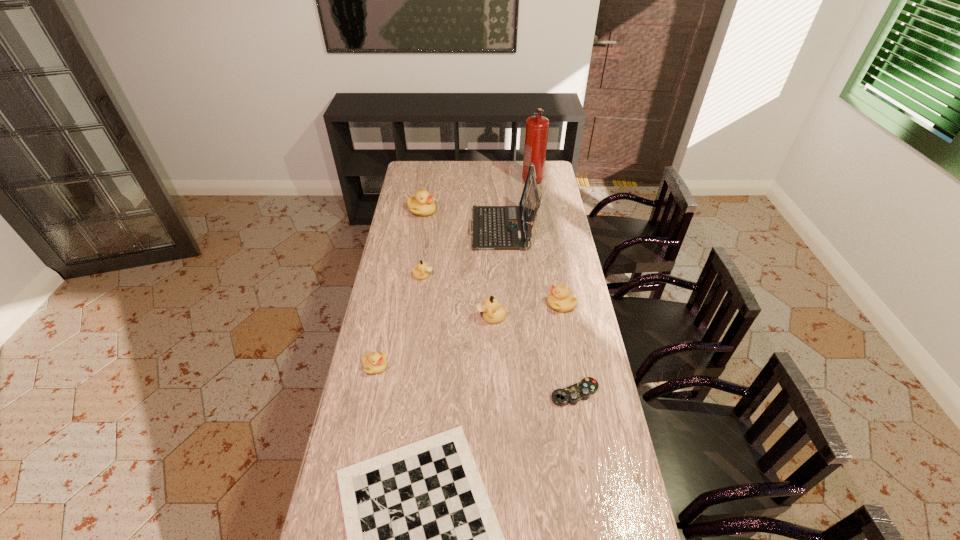
At what (x,y) coordinates should I click in order to perform the action: click on the fourth farthest object. Please return your answer as a coordinate pair (x, y). Image resolution: width=960 pixels, height=540 pixels. Looking at the image, I should click on (421, 272).

Image resolution: width=960 pixels, height=540 pixels. Identify the location of the seventh tallest object. (373, 363).

You are a GUI agent. You are given a task and a screenshot of the screen. Output one action in this format:
    pyautogui.click(x=<x>, y=<y>)
    Task: Click on the shortest duckling
    Image resolution: width=960 pixels, height=540 pixels.
    Given the screenshot: What is the action you would take?
    pyautogui.click(x=373, y=363)

This screenshot has height=540, width=960. I want to click on the second nearest object, so click(x=572, y=394).

Where is `control`? This screenshot has width=960, height=540. control is located at coordinates point(572,394).

Where is `vacant space situated on the handle side the tallest object`? The image size is (960, 540). vacant space situated on the handle side the tallest object is located at coordinates [x=535, y=197].

Locate an element on the screen. The image size is (960, 540). free location located 0.190m on the front-facing side of the laptop computer is located at coordinates (431, 231).

Locate an element on the screen. Image resolution: width=960 pixels, height=540 pixels. free region located on the front-facing side of the laptop computer is located at coordinates (404, 231).

Identify the location of vacant space located on the front-facing side of the laptop computer. This screenshot has height=540, width=960. (426, 231).

You are a GUI agent. You are given a task and a screenshot of the screen. Output one action in this format:
    pyautogui.click(x=<x>, y=<y>)
    Task: Click on the free location located 0.260m on the front-facing side of the biggest yellow duckling
    The image size is (960, 540).
    Given the screenshot: What is the action you would take?
    click(x=488, y=211)